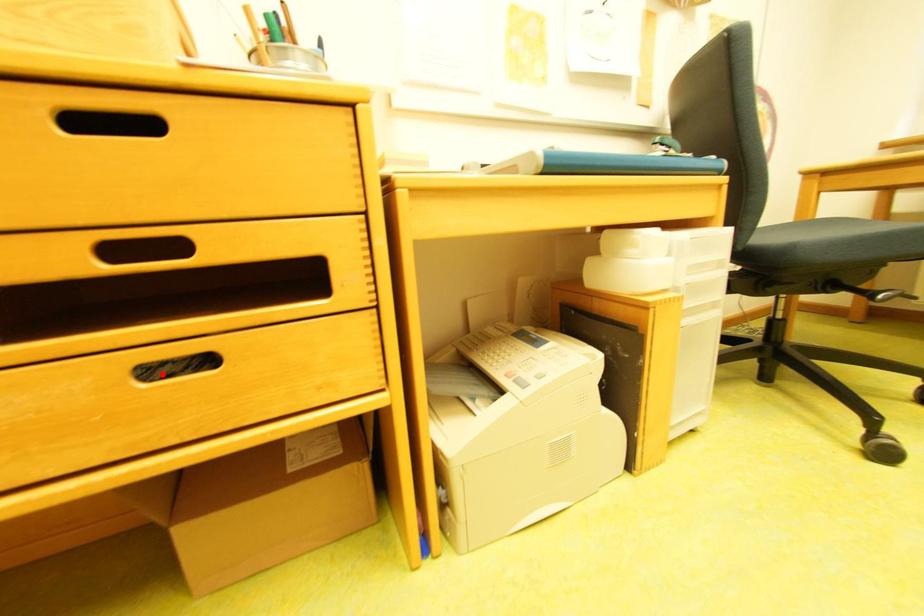
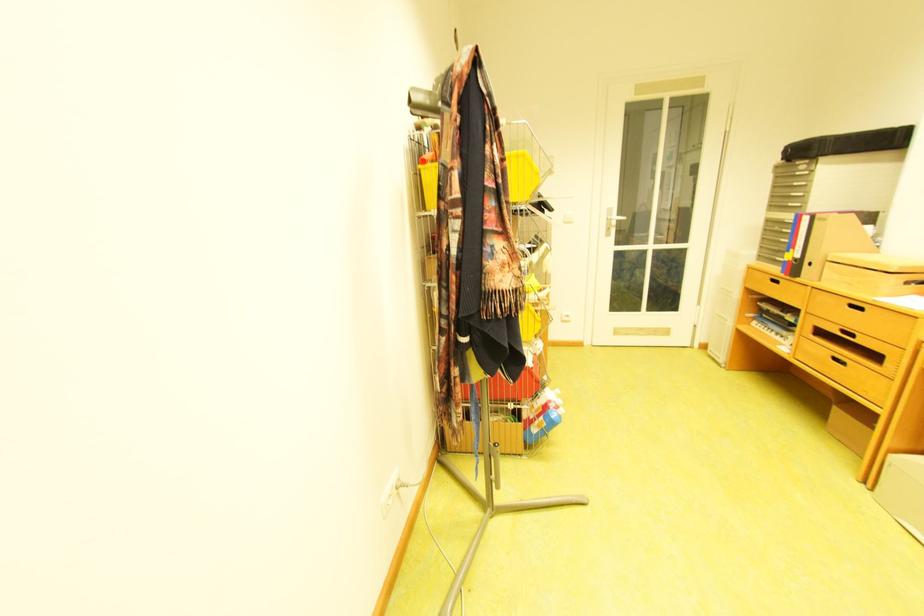
Question: A red point is marked in image1. In image2, is the corresponding 3D point closer to the camera or farther? Reply with the corresponding letter.

Choices:
 (A) The corresponding 3D point is closer.
 (B) The corresponding 3D point is farther.

Answer: (B)